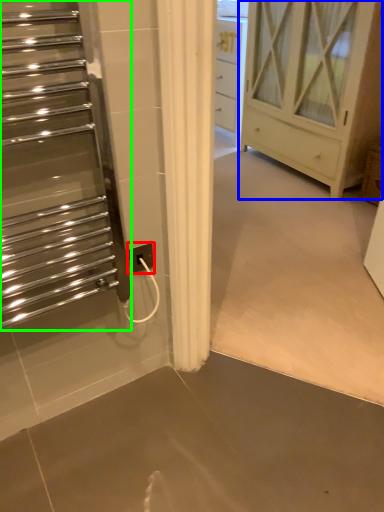
Question: Which object is positioned closest to electric outlet (highlighted by a red box)? Select from chest of drawers (highlighted by a blue box) and escalator (highlighted by a green box).

Choices:
 (A) chest of drawers
 (B) escalator

Answer: (B)